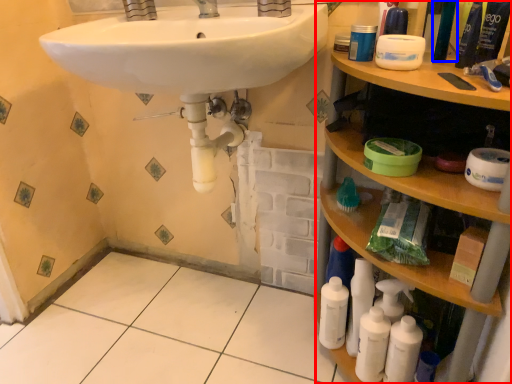
Question: Which point is further to the camera, cabinet (highlighted by a red box) or mouthwash (highlighted by a blue box)?

Choices:
 (A) cabinet
 (B) mouthwash

Answer: (B)